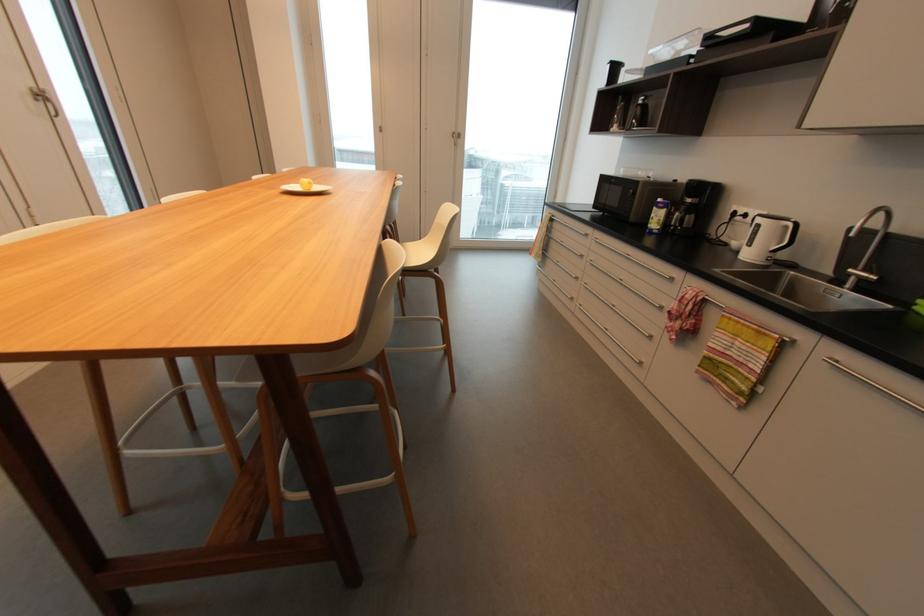
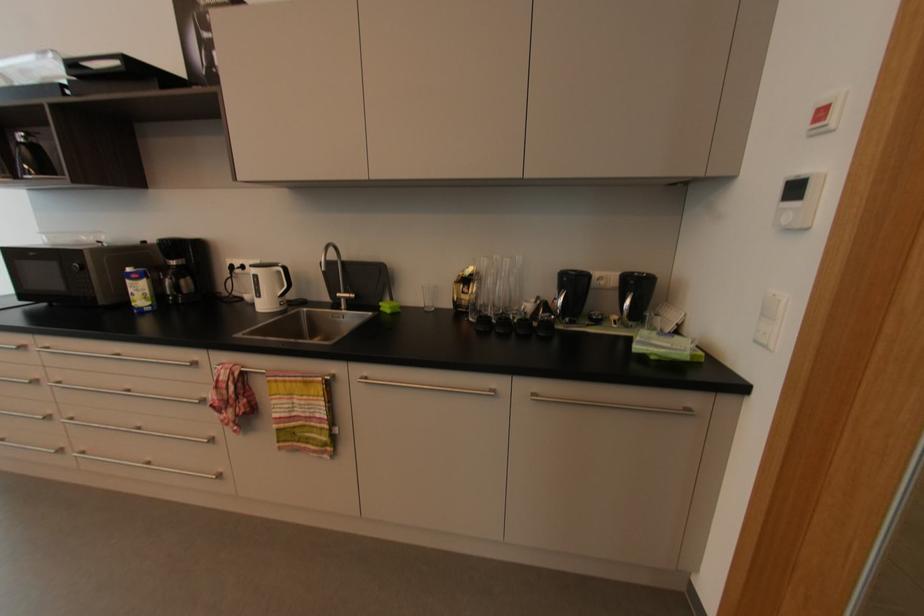
Find the pixel in the second image that matches the point at 781,336 in the first image.

(323, 379)